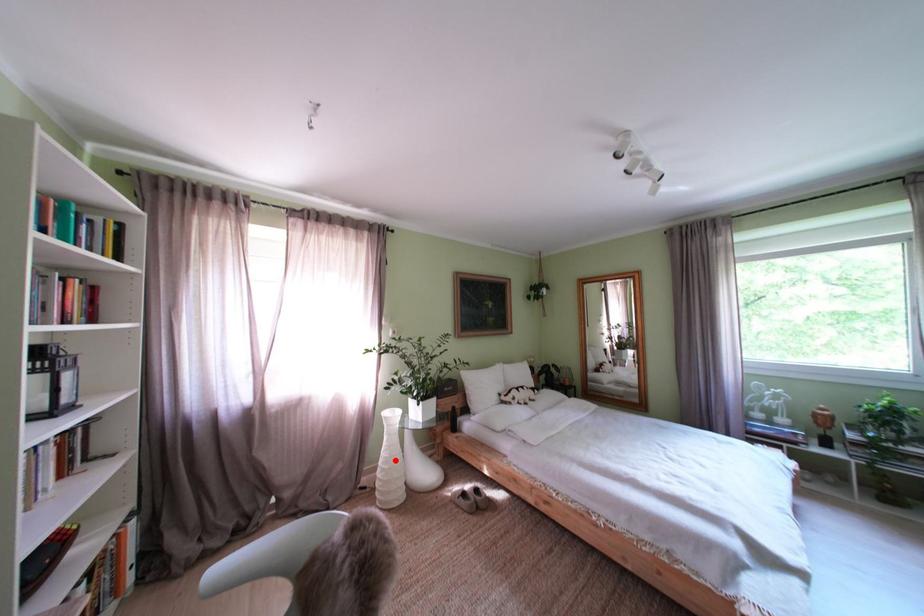
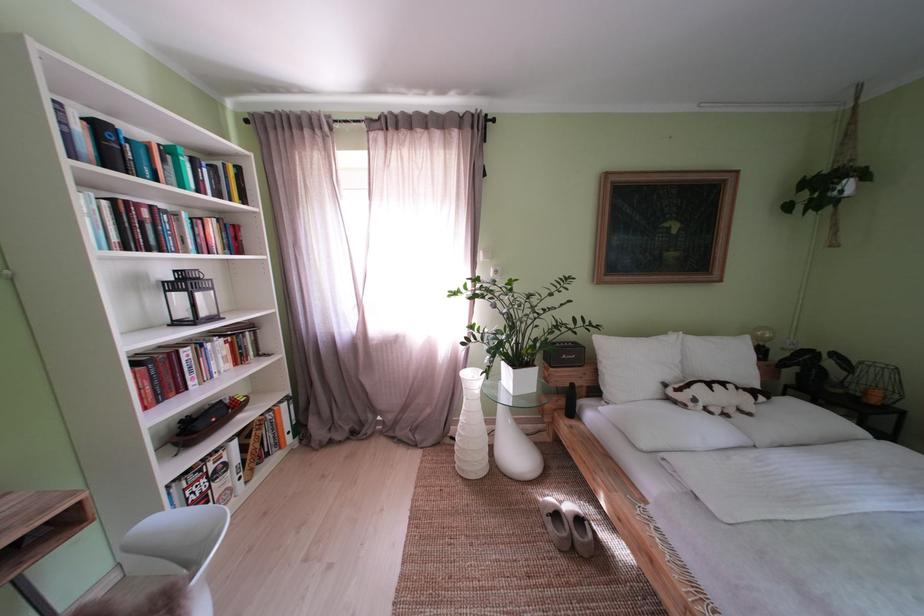
In the second image, find the point that corresponds to the highlighted location in the first image.

(472, 424)